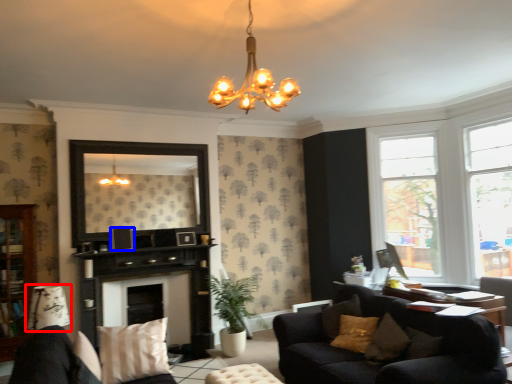
Question: Which point is further to the camera, lamp (highlighted by a red box) or picture frame (highlighted by a blue box)?

Choices:
 (A) lamp
 (B) picture frame

Answer: (B)